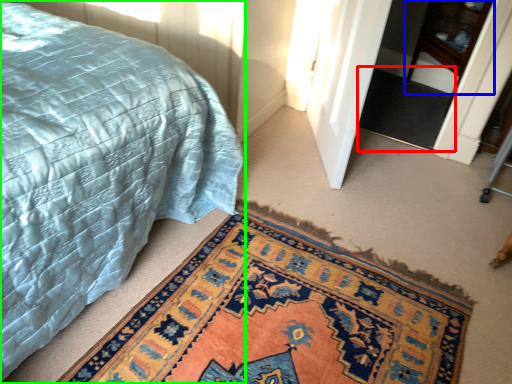
Question: Which object is positioned farthest from doormat (highlighted by a red box)? Select from dresser (highlighted by a blue box) and bed (highlighted by a green box).

Choices:
 (A) dresser
 (B) bed

Answer: (B)